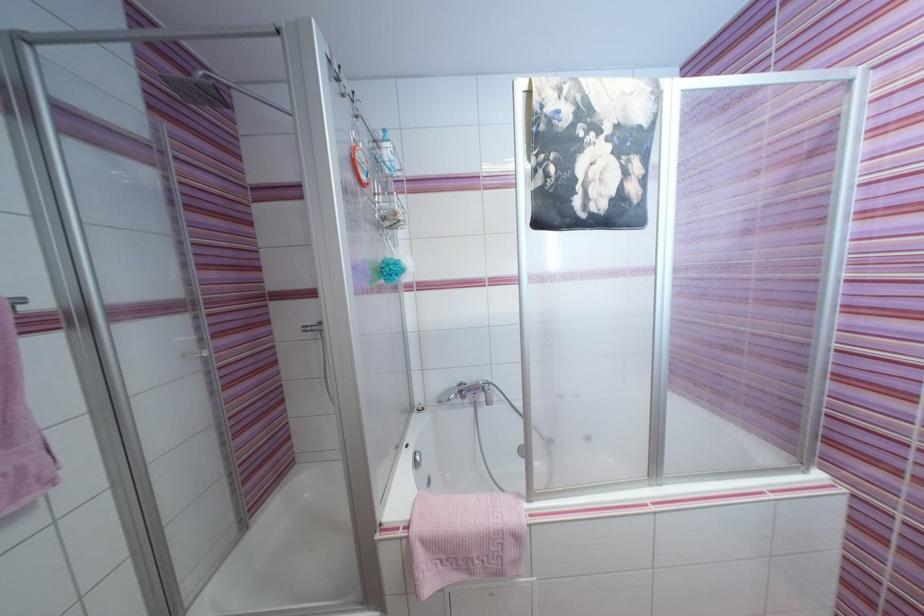
Where is `white pump top`? This screenshot has width=924, height=616. white pump top is located at coordinates click(386, 155).